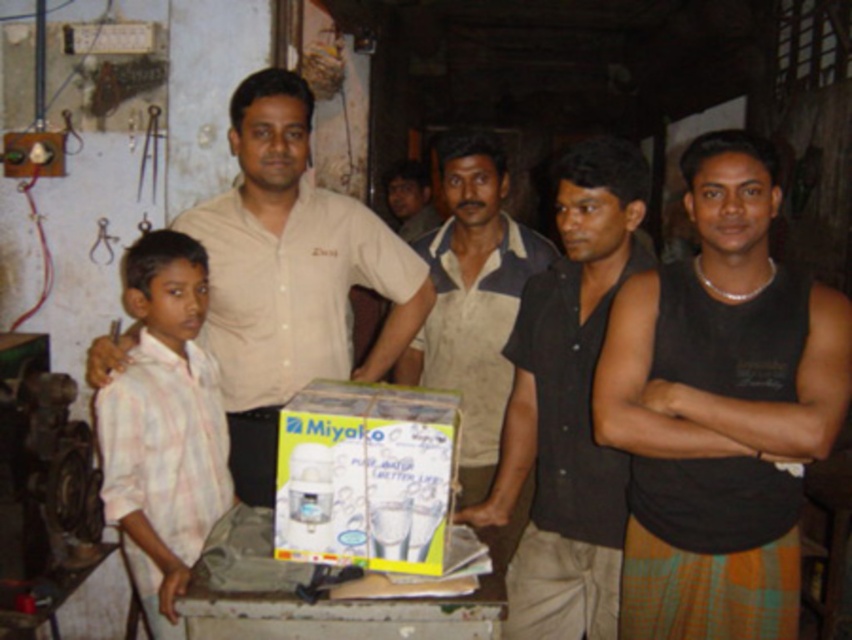
You are organizing a photo shoot and need to place two models wearing the black sleeveless shirt at right and white textured shirt at center. Based on the scene description, which model should stand to the left of the other?

The white textured shirt at center should be positioned to the left of the black sleeveless shirt at right because the black sleeveless shirt at right is on the right side of the white textured shirt at center.

You are organizing a photo shoot and need to arrange two shirts, the black matte shirt at center and the white textured shirt at center, on a mannequin. Based on the scene description, which shirt should be placed higher on the mannequin?

The black matte shirt at center is much taller than the white textured shirt at center, so it should be placed higher on the mannequin to reflect their relative sizes.

You are standing in the workshop and want to place a small sensor at the closest point to the camera between the two points labeled point (694, 296) and point (471, 209). Which point should you choose?

You should choose point (694, 296) because it is closer to the camera than point (471, 209).